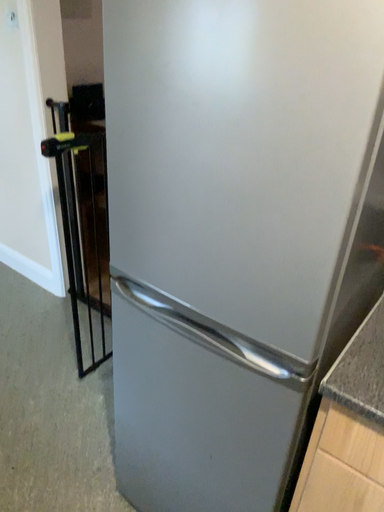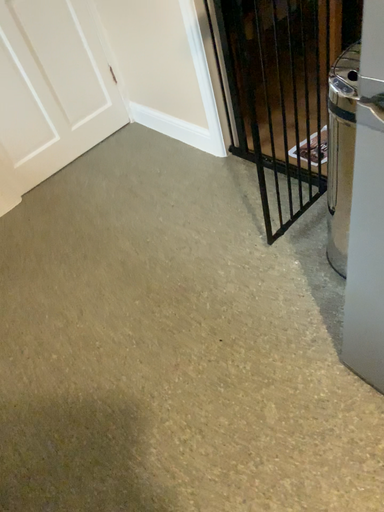
Question: Which way did the camera rotate in the video?

Choices:
 (A) rotated left
 (B) rotated right

Answer: (A)